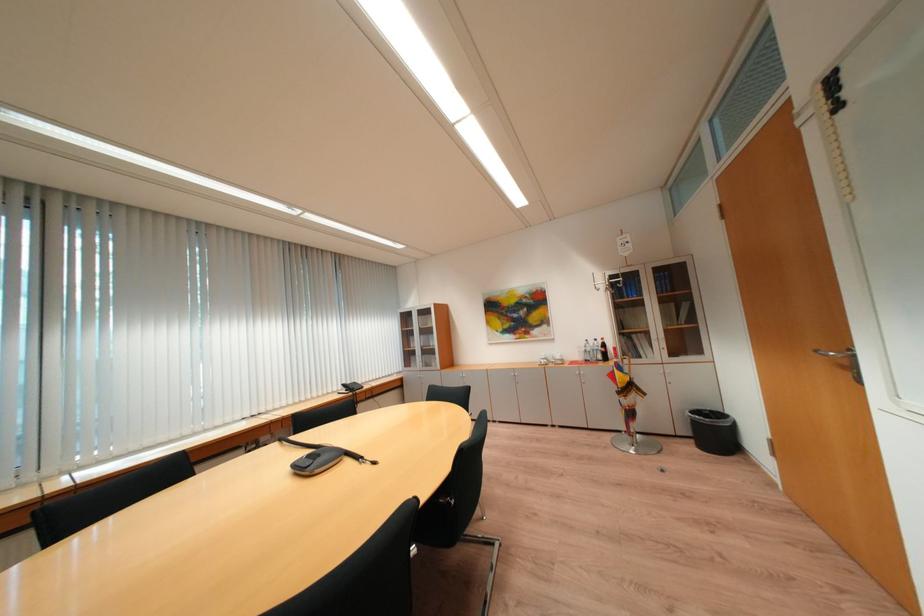
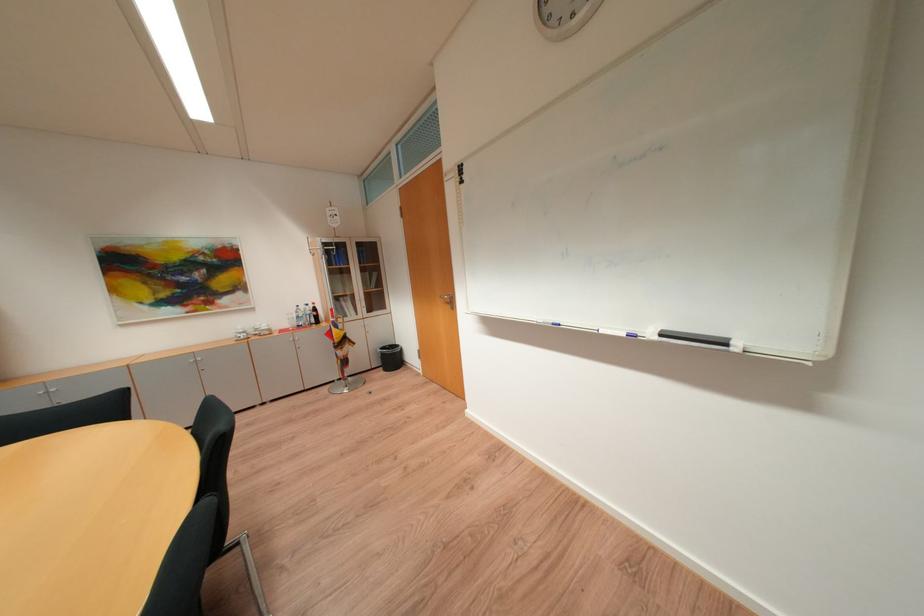
The point at (723, 434) is marked in the first image. Where is the corresponding point in the second image?

(400, 360)